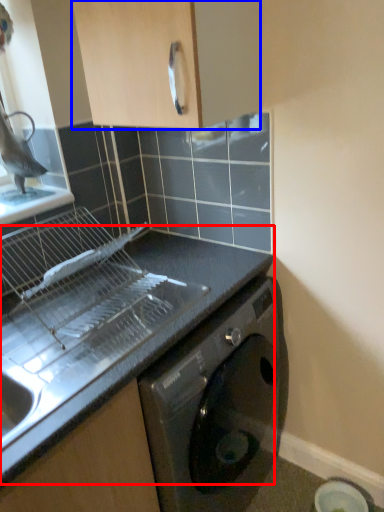
Question: Which object appears farthest to the camera in this image, countertop (highlighted by a red box) or cabinetry (highlighted by a blue box)?

Choices:
 (A) countertop
 (B) cabinetry

Answer: (A)